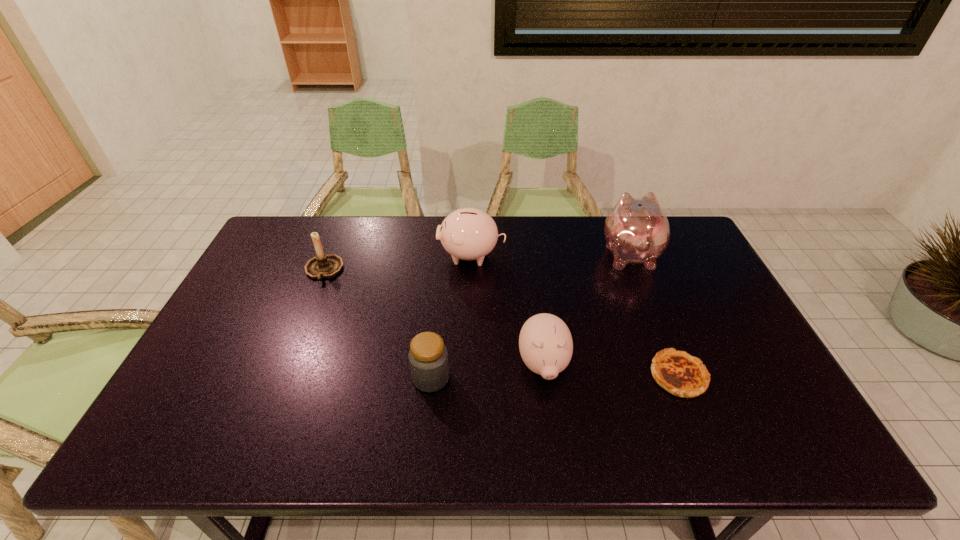
Locate an element on the screen. the tallest object is located at coordinates (636, 230).

In order to click on the tallest piggy bank in this screenshot , I will do `click(636, 230)`.

The image size is (960, 540). I want to click on the leftmost piggy bank, so click(x=468, y=233).

Find the location of a particular element. The height and width of the screenshot is (540, 960). the leftmost object is located at coordinates (322, 265).

This screenshot has height=540, width=960. What are the coordinates of `the fourth object from left to right` in the screenshot? It's located at (545, 342).

In order to click on the nearest piggy bank in this screenshot , I will do `click(545, 342)`.

The height and width of the screenshot is (540, 960). I want to click on jar, so click(428, 357).

Where is `quiche`? This screenshot has width=960, height=540. quiche is located at coordinates (679, 373).

Image resolution: width=960 pixels, height=540 pixels. I want to click on vacant space located 0.060m on the front facing side of the tallest piggy bank, so click(x=617, y=224).

Locate an element on the screen. This screenshot has width=960, height=540. vacant space situated 0.090m on the front facing side of the tallest piggy bank is located at coordinates (615, 219).